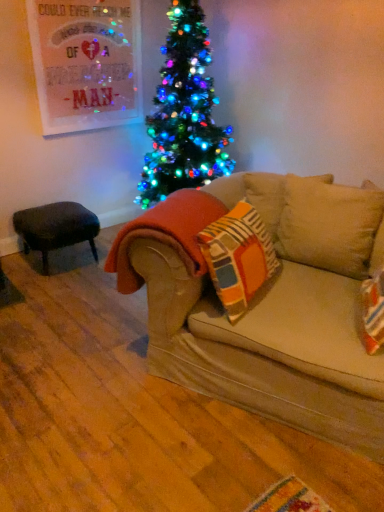
Question: From the image's perspective, would you say velvet dark brown stool at left is positioned over beige fabric couch at center?

Choices:
 (A) no
 (B) yes

Answer: (B)

Question: Is velvet dark brown stool at left thinner than beige fabric couch at center?

Choices:
 (A) no
 (B) yes

Answer: (B)

Question: Is velvet dark brown stool at left behind beige fabric couch at center?

Choices:
 (A) yes
 (B) no

Answer: (A)

Question: Considering the relative positions of velvet dark brown stool at left and beige fabric couch at center in the image provided, is velvet dark brown stool at left to the right of beige fabric couch at center from the viewer's perspective?

Choices:
 (A) no
 (B) yes

Answer: (A)

Question: Is velvet dark brown stool at left bigger than beige fabric couch at center?

Choices:
 (A) no
 (B) yes

Answer: (A)

Question: In terms of height, does velvet dark brown stool at left look taller or shorter compared to orange fleece blanket at center?

Choices:
 (A) tall
 (B) short

Answer: (B)

Question: From the image's perspective, is velvet dark brown stool at left above or below orange fleece blanket at center?

Choices:
 (A) above
 (B) below

Answer: (A)

Question: From a real-world perspective, is velvet dark brown stool at left physically located above or below orange fleece blanket at center?

Choices:
 (A) above
 (B) below

Answer: (B)

Question: Does point (91, 225) appear closer or farther from the camera than point (193, 239)?

Choices:
 (A) closer
 (B) farther

Answer: (B)

Question: In terms of size, does orange fleece blanket at center appear bigger or smaller than velvet dark brown stool at left?

Choices:
 (A) small
 (B) big

Answer: (A)

Question: Is orange fleece blanket at center taller or shorter than velvet dark brown stool at left?

Choices:
 (A) tall
 (B) short

Answer: (A)

Question: Is orange fleece blanket at center wider or thinner than velvet dark brown stool at left?

Choices:
 (A) thin
 (B) wide

Answer: (A)

Question: From the image's perspective, relative to velvet dark brown stool at left, is orange fleece blanket at center above or below?

Choices:
 (A) below
 (B) above

Answer: (A)

Question: From the image's perspective, is beige fabric couch at center located above or below velvet dark brown stool at left?

Choices:
 (A) above
 (B) below

Answer: (B)

Question: Is beige fabric couch at center to the left or to the right of velvet dark brown stool at left in the image?

Choices:
 (A) left
 (B) right

Answer: (B)